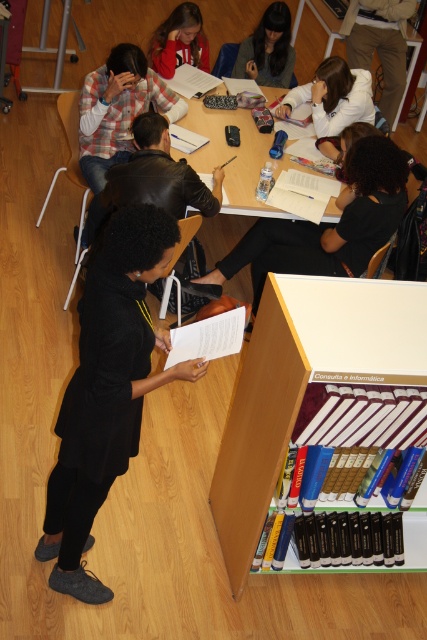
Based on the scene description, which object occupies more space in the image? The wooden table at center or the matte red hoodie at upper center?

The wooden table at center is larger in size than the matte red hoodie at upper center, so the wooden table at center occupies more space in the image.

You are a fashion designer observing a group of people in a library. You notice two clothing items, the plaid fabric shirt at upper left and the white matte jacket at upper center. Which clothing item has a larger width?

The plaid fabric shirt at upper left has a larger width than the white matte jacket at upper center.

You are a librarian organizing items in the library. You have to place the plaid fabric shirt at upper left and the hardcover books at center on a shelf. Which item should you place first to ensure proper stacking?

The hardcover books at center should be placed first because they are taller than the plaid fabric shirt at upper left, allowing the shirt to be stacked on top without overhanging.